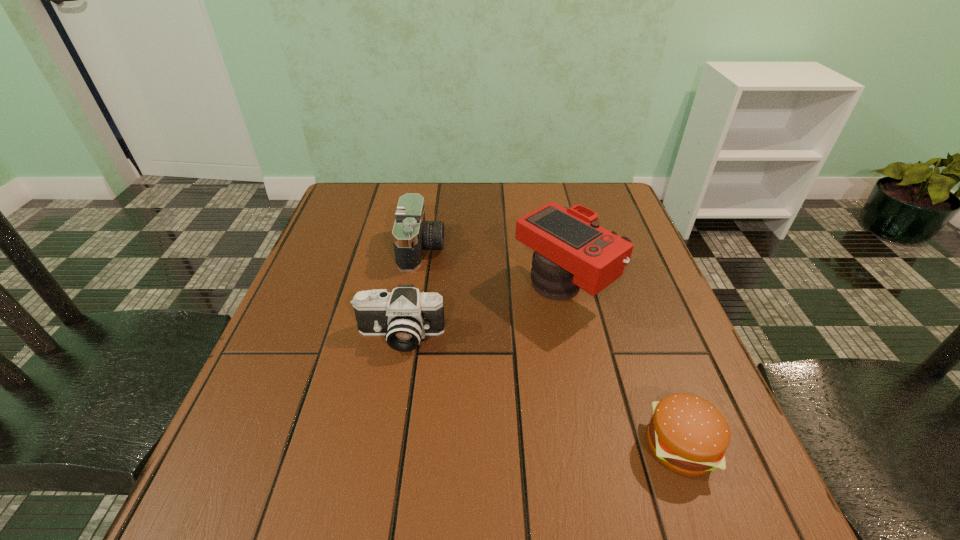
In the image, there is a desktop. Identify the location of vacant region at the far edge. (493, 222).

Locate an element on the screen. vacant space at the near edge is located at coordinates (612, 526).

Find the location of `vacant area at the left edge of the desktop`. vacant area at the left edge of the desktop is located at coordinates (302, 340).

In the image, there is a desktop. Identify the location of free space at the right edge. (597, 294).

Where is `free location at the far left corner of the desktop`? Image resolution: width=960 pixels, height=540 pixels. free location at the far left corner of the desktop is located at coordinates (364, 188).

The width and height of the screenshot is (960, 540). I want to click on vacant space at the near left corner of the desktop, so click(256, 488).

I want to click on free space at the near right corner of the desktop, so click(734, 534).

Where is `vacant space that is in between the nearest object and the rightmost camera`? vacant space that is in between the nearest object and the rightmost camera is located at coordinates (622, 368).

I want to click on vacant space that is in between the rightmost camera and the hamburger, so click(622, 368).

Find the location of a particular element. vacant area between the tallest camera and the shortest object is located at coordinates (622, 368).